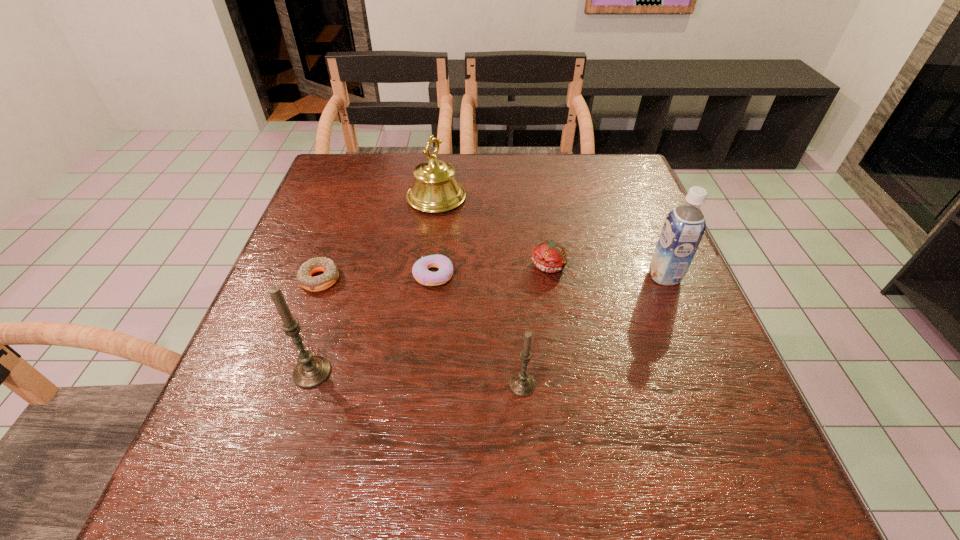
I want to click on free space for a new candle on the right, so click(x=743, y=399).